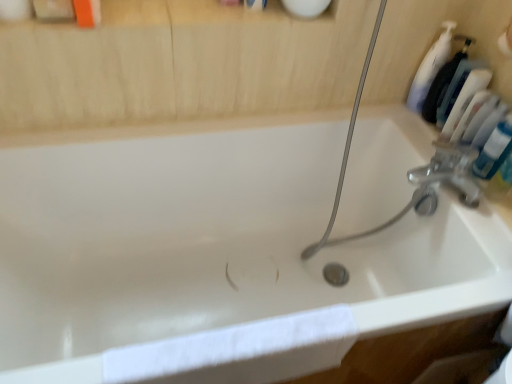
Question: Could you tell me if white plastic bottle at upper right is turned towards blue glossy tube at upper right?

Choices:
 (A) no
 (B) yes

Answer: (A)

Question: Does white plastic bottle at upper right have a greater height compared to blue glossy tube at upper right?

Choices:
 (A) no
 (B) yes

Answer: (B)

Question: Is blue glossy tube at upper right completely or partially inside white plastic bottle at upper right?

Choices:
 (A) no
 (B) yes

Answer: (A)

Question: Is white plastic bottle at upper right wider than blue glossy tube at upper right?

Choices:
 (A) yes
 (B) no

Answer: (A)

Question: Does white plastic bottle at upper right come in front of blue glossy tube at upper right?

Choices:
 (A) no
 (B) yes

Answer: (A)

Question: Considering the relative sizes of white plastic bottle at upper right and blue glossy tube at upper right in the image provided, is white plastic bottle at upper right shorter than blue glossy tube at upper right?

Choices:
 (A) no
 (B) yes

Answer: (A)

Question: Is white glossy bathtub at center oriented towards white plastic bottle at upper right?

Choices:
 (A) no
 (B) yes

Answer: (A)

Question: Is the depth of white glossy bathtub at center greater than that of white plastic bottle at upper right?

Choices:
 (A) yes
 (B) no

Answer: (B)

Question: From a real-world perspective, is white glossy bathtub at center positioned under white plastic bottle at upper right based on gravity?

Choices:
 (A) no
 (B) yes

Answer: (B)

Question: Is white glossy bathtub at center completely or partially outside of white plastic bottle at upper right?

Choices:
 (A) no
 (B) yes

Answer: (B)

Question: From the image's perspective, does white glossy bathtub at center appear higher than white plastic bottle at upper right?

Choices:
 (A) yes
 (B) no

Answer: (B)

Question: Can you confirm if white glossy bathtub at center is wider than white plastic bottle at upper right?

Choices:
 (A) yes
 (B) no

Answer: (A)

Question: Is white plastic bottle at upper right shorter than white cotton towel at lower left?

Choices:
 (A) yes
 (B) no

Answer: (B)